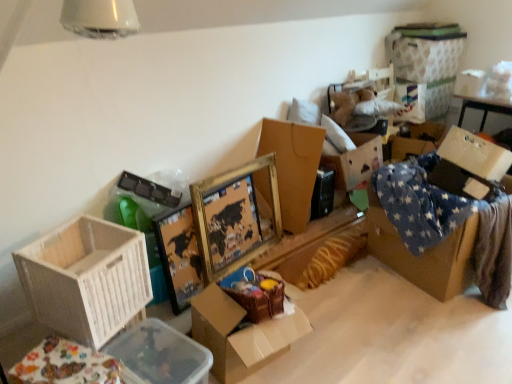
You are a GUI agent. You are given a task and a screenshot of the screen. Output one action in this format:
    pyautogui.click(x=<x>, y=<y>)
    Task: Click on the gold/gilded picture frame at center
    
    Given the screenshot: What is the action you would take?
    pyautogui.click(x=234, y=217)

This screenshot has width=512, height=384. What are the coordinates of `white fabric storage box at upper right, the 1th storage box in the right-to-left sequence` in the screenshot? It's located at (424, 68).

This screenshot has width=512, height=384. Describe the element at coordinates (161, 354) in the screenshot. I see `clear plastic container at lower left, positioned as the third storage box in right-to-left order` at that location.

The height and width of the screenshot is (384, 512). Describe the element at coordinates (355, 161) in the screenshot. I see `brown cardboard box at center, acting as the 2th storage box starting from the front` at that location.

The height and width of the screenshot is (384, 512). I want to click on cardboard box at center, the second box viewed from the front, so click(241, 334).

The image size is (512, 384). Find the location of `the 1st box positioned below the brown cardboard box at center, the 2th storage box in the back-to-front sequence (from a real-world perspective)`. the 1st box positioned below the brown cardboard box at center, the 2th storage box in the back-to-front sequence (from a real-world perspective) is located at coordinates [x=86, y=279].

Consider the image. Is brown cardboard box at center, the 2th storage box in the back-to-front sequence, placed right next to white wood crate at lower left, the 1th box in the front-to-back sequence?

No.

Is the position of brown cardboard box at center, the 2th storage box in the back-to-front sequence, more distant than that of white wood crate at lower left, which is the third box in back-to-front order?

Yes.

How different are the orientations of brown cardboard box at center, the 2th storage box in the back-to-front sequence, and white wood crate at lower left, which is the third box in back-to-front order, in degrees?

There is a 35.8-degree angle between the facing directions of brown cardboard box at center, the 2th storage box in the back-to-front sequence, and white wood crate at lower left, which is the third box in back-to-front order.

Which point is more forward, (28,249) or (317,151)?

The point (28,249) is in front.

Does white wood crate at lower left, the 1th box in the front-to-back sequence, have a lesser width compared to gold cardboard box at center, acting as the 1th box starting from the back?

Yes.

Can you tell me how much white wood crate at lower left, the 1th box in the front-to-back sequence, and gold cardboard box at center, arranged as the 3th box when viewed from the front, differ in facing direction?

The angular difference between white wood crate at lower left, the 1th box in the front-to-back sequence, and gold cardboard box at center, arranged as the 3th box when viewed from the front, is 15.6 degrees.

Measure the distance between white wood crate at lower left, the 1th box in the front-to-back sequence, and gold cardboard box at center, arranged as the 3th box when viewed from the front.

white wood crate at lower left, the 1th box in the front-to-back sequence, and gold cardboard box at center, arranged as the 3th box when viewed from the front, are 1.37 meters apart.

Considering the sizes of objects brown cardboard box at center, which ranks as the second storage box in left-to-right order, and cardboard box at center, acting as the 2th box starting from the back, in the image provided, who is smaller, brown cardboard box at center, which ranks as the second storage box in left-to-right order, or cardboard box at center, acting as the 2th box starting from the back,?

Smaller between the two is brown cardboard box at center, which ranks as the second storage box in left-to-right order.

Is point (337, 159) positioned behind point (283, 298)?

Yes, point (337, 159) is behind point (283, 298).

From their relative heights in the image, would you say brown cardboard box at center, placed as the second storage box when sorted from bottom to top, is taller or shorter than cardboard box at center, the second box viewed from the front?

Clearly, brown cardboard box at center, placed as the second storage box when sorted from bottom to top, is taller compared to cardboard box at center, the second box viewed from the front.

Is clear plastic container at lower left, the 1th storage box viewed from the left, inside the boundaries of gold cardboard box at center, acting as the 1th box starting from the back, or outside?

clear plastic container at lower left, the 1th storage box viewed from the left, exists outside the volume of gold cardboard box at center, acting as the 1th box starting from the back.

From a real-world perspective, which object rests below the other?

In real-world perspective, clear plastic container at lower left, arranged as the third storage box when viewed from the back, is lower.

Considering the positions of points (172, 353) and (283, 157), is point (172, 353) closer to camera compared to point (283, 157)?

Yes, it is.

Image resolution: width=512 pixels, height=384 pixels. Find the location of `storage box on the left of gold cardboard box at center, acting as the 1th box starting from the back`. storage box on the left of gold cardboard box at center, acting as the 1th box starting from the back is located at coordinates (161, 354).

From the picture: Which is closer, (245,355) or (306,180)?

Clearly, point (245,355) is closer to the camera than point (306,180).

Which object is more forward, cardboard box at center, acting as the 2th box starting from the back, or gold cardboard box at center, arranged as the 3th box when viewed from the front?

cardboard box at center, acting as the 2th box starting from the back, is in front.

Is cardboard box at center, acting as the 2th box starting from the back, with gold cardboard box at center, arranged as the 3th box when viewed from the front?

There is a gap between cardboard box at center, acting as the 2th box starting from the back, and gold cardboard box at center, arranged as the 3th box when viewed from the front.

Is cardboard box at center, the second box viewed from the front, positioned with its back to gold cardboard box at center, arranged as the 3th box when viewed from the front?

cardboard box at center, the second box viewed from the front, is not turned away from gold cardboard box at center, arranged as the 3th box when viewed from the front.

From the picture: From their relative heights in the image, would you say gold/gilded picture frame at center is taller or shorter than clear plastic container at lower left, positioned as the 1th storage box in bottom-to-top order?

Clearly, gold/gilded picture frame at center is taller compared to clear plastic container at lower left, positioned as the 1th storage box in bottom-to-top order.

Which is less distant, [234,184] or [204,380]?

Point [234,184] is farther from the camera than point [204,380].

Considering the relative positions of gold/gilded picture frame at center and clear plastic container at lower left, the 1th storage box viewed from the left, in the image provided, is gold/gilded picture frame at center to the left or to the right of clear plastic container at lower left, the 1th storage box viewed from the left,?

Based on their positions, gold/gilded picture frame at center is located to the right of clear plastic container at lower left, the 1th storage box viewed from the left.

Based on the photo, from the image's perspective, between white cardboard box at upper right and white wood crate at lower left, the 1th box in the front-to-back sequence, which one is located above?

From the image's view, white cardboard box at upper right is above.

Is white cardboard box at upper right looking in the opposite direction of white wood crate at lower left, the 1th box in the front-to-back sequence?

No.

Is white cardboard box at upper right wider than white wood crate at lower left, which is the third box in back-to-front order?

Incorrect, the width of white cardboard box at upper right does not surpass that of white wood crate at lower left, which is the third box in back-to-front order.

From a real-world perspective, starting from the white wood crate at lower left, the 1th box in the front-to-back sequence, which storage box is the 1st one vertically above it? Please provide its 2D coordinates.

[(355, 161)]

From the image's perspective, starting from the gold cardboard box at center, acting as the 1th box starting from the back, which box is the 1st one below? Please provide its 2D coordinates.

[(86, 279)]

In the scene shown: Considering their positions, is cardboard box at center, acting as the 2th box starting from the back, positioned closer to brown cardboard box at center, which ranks as the second storage box in left-to-right order, than gold/gilded picture frame at center?

Based on the image, gold/gilded picture frame at center appears to be nearer to brown cardboard box at center, which ranks as the second storage box in left-to-right order.

Based on their spatial positions, is white wood crate at lower left, the 1th box in the front-to-back sequence, or cardboard box at center, the second box viewed from the front, further from brown cardboard box at center, placed as the second storage box when sorted from bottom to top?

The object further to brown cardboard box at center, placed as the second storage box when sorted from bottom to top, is white wood crate at lower left, the 1th box in the front-to-back sequence.

Considering their positions, is white cardboard box at upper right positioned closer to white wood crate at lower left, which is the third box in back-to-front order, than brown cardboard box at center, which is counted as the 2th storage box, starting from the right?

brown cardboard box at center, which is counted as the 2th storage box, starting from the right, is closer to white wood crate at lower left, which is the third box in back-to-front order.

Estimate the real-world distances between objects in this image. Which object is further from cardboard box at center, the second box viewed from the front, white cardboard box at upper right or white fabric storage box at upper right, acting as the 1th storage box starting from the top?

Among the two, white fabric storage box at upper right, acting as the 1th storage box starting from the top, is located further to cardboard box at center, the second box viewed from the front.

Estimate the real-world distances between objects in this image. Which object is further from gold/gilded picture frame at center, white fabric storage box at upper right, the third storage box viewed from the left, or white wood crate at lower left, the 1th box in the front-to-back sequence?

Among the two, white fabric storage box at upper right, the third storage box viewed from the left, is located further to gold/gilded picture frame at center.

When comparing their distances from brown cardboard box at center, the 2th storage box in the back-to-front sequence, does cardboard box at center, acting as the 2th box starting from the back, or gold cardboard box at center, arranged as the 3th box when viewed from the front, seem closer?

Based on the image, gold cardboard box at center, arranged as the 3th box when viewed from the front, appears to be nearer to brown cardboard box at center, the 2th storage box in the back-to-front sequence.

Estimate the real-world distances between objects in this image. Which object is further from gold/gilded picture frame at center, white fabric storage box at upper right, the 1th storage box in the right-to-left sequence, or cardboard box at center, acting as the 2th box starting from the back?

white fabric storage box at upper right, the 1th storage box in the right-to-left sequence.

Which object lies further to the anchor point clear plastic container at lower left, the 3th storage box from the top, white wood crate at lower left, the 1th box in the front-to-back sequence, or white fabric storage box at upper right, acting as the 1th storage box starting from the top?

white fabric storage box at upper right, acting as the 1th storage box starting from the top, is positioned further to the anchor clear plastic container at lower left, the 3th storage box from the top.

Where is `box between cardboard box at center, acting as the 2th box starting from the back, and brown cardboard box at center, acting as the 2th storage box starting from the front, along the z-axis`? The width and height of the screenshot is (512, 384). box between cardboard box at center, acting as the 2th box starting from the back, and brown cardboard box at center, acting as the 2th storage box starting from the front, along the z-axis is located at coordinates (293, 167).

This screenshot has width=512, height=384. I want to click on picture frame between clear plastic container at lower left, the 3th storage box from the top, and brown cardboard box at center, which ranks as the second storage box in left-to-right order, in the front-back direction, so point(234,217).

Find the location of a particular element. Image resolution: width=512 pixels, height=384 pixels. storage box between gold/gilded picture frame at center and white fabric storage box at upper right, which appears as the first storage box when viewed from the back, from left to right is located at coordinates (355, 161).

This screenshot has width=512, height=384. Find the location of `storage box situated between gold cardboard box at center, arranged as the 3th box when viewed from the front, and white cardboard box at upper right from left to right`. storage box situated between gold cardboard box at center, arranged as the 3th box when viewed from the front, and white cardboard box at upper right from left to right is located at coordinates (355, 161).